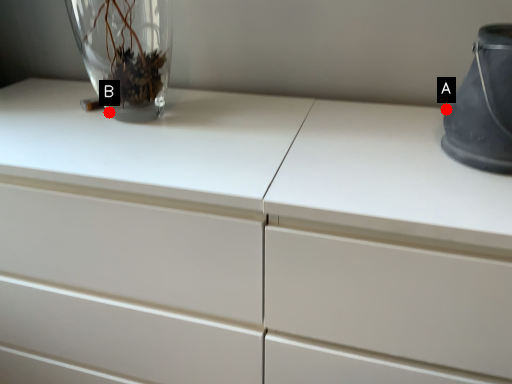
Question: Two points are circled on the image, labeled by A and B beside each circle. Which point is closer to the camera?

Choices:
 (A) A is closer
 (B) B is closer

Answer: (A)